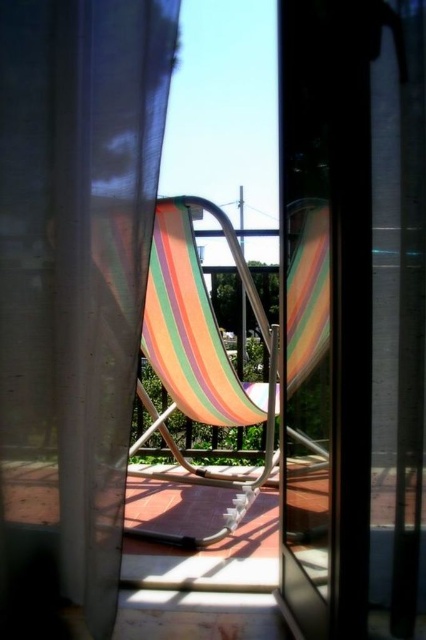
Does multicolored fabric beach chair at center have a smaller size compared to translucent plastic screen door at center?

Actually, multicolored fabric beach chair at center might be larger than translucent plastic screen door at center.

What do you see at coordinates (199, 340) in the screenshot? The width and height of the screenshot is (426, 640). I see `multicolored fabric beach chair at center` at bounding box center [199, 340].

Between point (204, 340) and point (302, 394), which one is positioned behind?

The point (204, 340) is behind.

Where is `multicolored fabric beach chair at center`? The image size is (426, 640). multicolored fabric beach chair at center is located at coordinates (199, 340).

Does sheer white curtain at center have a smaller size compared to translucent plastic screen door at center?

No, sheer white curtain at center is not smaller than translucent plastic screen door at center.

Between point (167, 8) and point (302, 422), which one is positioned in front?

Point (167, 8) is more forward.

The image size is (426, 640). Find the location of `sheer white curtain at center`. sheer white curtain at center is located at coordinates (72, 285).

Does point (88, 177) come closer to viewer compared to point (164, 333)?

Yes, point (88, 177) is closer to viewer.

How far apart are sheer white curtain at center and multicolored fabric beach chair at center?

A distance of 23.93 inches exists between sheer white curtain at center and multicolored fabric beach chair at center.

Is point (78, 588) closer to viewer compared to point (250, 481)?

Yes, point (78, 588) is in front of point (250, 481).

The width and height of the screenshot is (426, 640). Find the location of `sheer white curtain at center`. sheer white curtain at center is located at coordinates (72, 285).